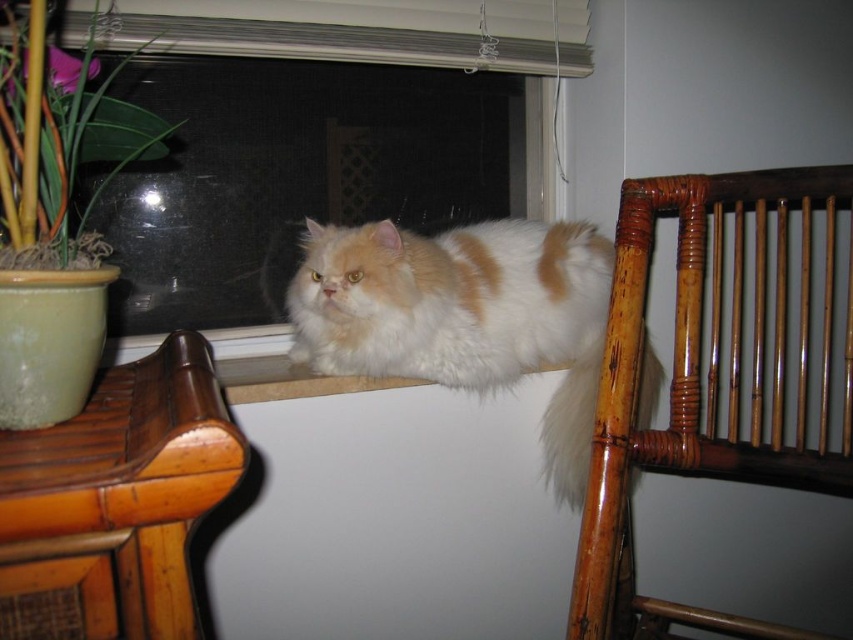
Question: Which point is closer to the camera?

Choices:
 (A) (543, 268)
 (B) (125, 416)
 (C) (48, 260)

Answer: (C)

Question: Is fuzzy white cat at center closer to the viewer compared to bamboo chair at right?

Choices:
 (A) no
 (B) yes

Answer: (A)

Question: Does fuzzy white cat at center appear over green leafy plant at left?

Choices:
 (A) yes
 (B) no

Answer: (B)

Question: Estimate the real-world distances between objects in this image. Which object is closer to the green leafy plant at left?

Choices:
 (A) transparent glass window at center
 (B) bamboo chair at left

Answer: (A)

Question: Is bamboo chair at right bigger than green leafy plant at left?

Choices:
 (A) no
 (B) yes

Answer: (B)

Question: Among these points, which one is nearest to the camera?

Choices:
 (A) click(x=670, y=397)
 (B) click(x=515, y=83)

Answer: (A)